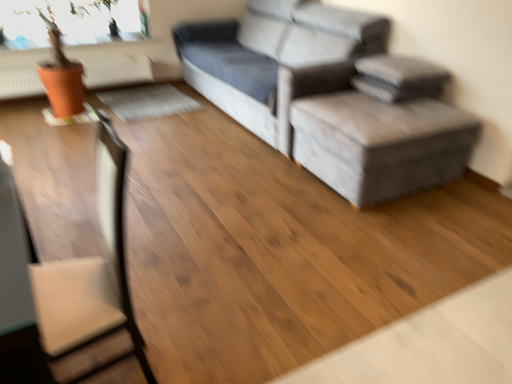
Measure the distance between gray fabric ottoman at center and camera.

gray fabric ottoman at center and camera are 7.65 feet apart.

This screenshot has height=384, width=512. What do you see at coordinates (380, 143) in the screenshot?
I see `gray fabric ottoman at center` at bounding box center [380, 143].

Identify the location of orange matte radiator at upper left. Image resolution: width=512 pixels, height=384 pixels. (117, 71).

Which of these two, brown leather swivel chair at left or gray fabric ottoman at center, is wider?

With larger width is gray fabric ottoman at center.

Considering the relative positions of brown leather swivel chair at left and gray fabric ottoman at center in the image provided, is brown leather swivel chair at left to the right of gray fabric ottoman at center from the viewer's perspective?

Incorrect, brown leather swivel chair at left is not on the right side of gray fabric ottoman at center.

Could you tell me if brown leather swivel chair at left is facing gray fabric ottoman at center?

No.

From a real-world perspective, is brown leather swivel chair at left physically located above or below gray fabric ottoman at center?

In terms of real-world spatial position, brown leather swivel chair at left is above gray fabric ottoman at center.

From a real-world perspective, is orange matte radiator at upper left on top of gray fabric couch at upper right?

Incorrect, from a real-world perspective, orange matte radiator at upper left is lower than gray fabric couch at upper right.

Is orange matte radiator at upper left facing away from gray fabric couch at upper right?

That's not correct — orange matte radiator at upper left is not looking away from gray fabric couch at upper right.

How much distance is there between orange matte radiator at upper left and gray fabric couch at upper right?

6.26 feet.

Which of these two, orange matte radiator at upper left or gray fabric couch at upper right, is thinner?

orange matte radiator at upper left is thinner.

Does gray fabric ottoman at center have a larger size compared to brown leather swivel chair at left?

Indeed, gray fabric ottoman at center has a larger size compared to brown leather swivel chair at left.

Is gray fabric ottoman at center in contact with brown leather swivel chair at left?

No, gray fabric ottoman at center is not making contact with brown leather swivel chair at left.

Is gray fabric ottoman at center at the left side of brown leather swivel chair at left?

In fact, gray fabric ottoman at center is to the right of brown leather swivel chair at left.

Between point (124, 84) and point (124, 172), which one is positioned in front?

The point (124, 172) is closer to the camera.

Relative to brown leather swivel chair at left, is orange matte radiator at upper left in front or behind?

orange matte radiator at upper left is positioned farther from the viewer than brown leather swivel chair at left.

Can you see orange matte radiator at upper left touching brown leather swivel chair at left?

No, orange matte radiator at upper left is not with brown leather swivel chair at left.

From the picture: How much distance is there between orange matte radiator at upper left and brown leather swivel chair at left?

The distance of orange matte radiator at upper left from brown leather swivel chair at left is 3.52 meters.

Is point (69, 350) positioned in front of point (7, 96)?

Yes.

From the image's perspective, is brown leather swivel chair at left above or below orange matte radiator at upper left?

Based on their image positions, brown leather swivel chair at left is located beneath orange matte radiator at upper left.

Is brown leather swivel chair at left touching orange matte radiator at upper left?

No, brown leather swivel chair at left is not touching orange matte radiator at upper left.

Locate an element on the screen. The image size is (512, 384). radiator behind the brown leather swivel chair at left is located at coordinates (117, 71).

Considering the points (53, 280) and (269, 33), which point is behind, point (53, 280) or point (269, 33)?

Positioned behind is point (269, 33).

From a real-world perspective, is brown leather swivel chair at left below gray fabric couch at upper right?

Indeed, from a real-world perspective, brown leather swivel chair at left is positioned beneath gray fabric couch at upper right.

Considering the sizes of brown leather swivel chair at left and gray fabric couch at upper right in the image, is brown leather swivel chair at left bigger or smaller than gray fabric couch at upper right?

In the image, brown leather swivel chair at left appears to be smaller than gray fabric couch at upper right.

At what (x,y) coordinates should I click in order to perform the action: click on studio couch on the right of brown leather swivel chair at left. Please return your answer as a coordinate pair (x, y). Looking at the image, I should click on (329, 100).

Which point is more distant from viewer, (263, 14) or (325, 118)?

The point (263, 14) is more distant.

Does gray fabric couch at upper right lie behind gray fabric ottoman at center?

Yes.

Considering the sizes of gray fabric couch at upper right and gray fabric ottoman at center in the image, is gray fabric couch at upper right bigger or smaller than gray fabric ottoman at center?

gray fabric couch at upper right is bigger than gray fabric ottoman at center.

From the image's perspective, between gray fabric couch at upper right and gray fabric ottoman at center, who is located below?

From the image's view, gray fabric ottoman at center is below.

I want to click on stool that is behind the brown leather swivel chair at left, so click(x=380, y=143).

I want to click on radiator below the gray fabric couch at upper right (from the image's perspective), so click(x=117, y=71).

Estimate the real-world distances between objects in this image. Which object is closer to orange matte radiator at upper left, brown leather swivel chair at left or gray fabric ottoman at center?

gray fabric ottoman at center is closer to orange matte radiator at upper left.

Estimate the real-world distances between objects in this image. Which object is closer to brown leather swivel chair at left, orange matte radiator at upper left or gray fabric couch at upper right?

The object closer to brown leather swivel chair at left is gray fabric couch at upper right.

Considering their positions, is orange matte radiator at upper left positioned closer to brown leather swivel chair at left than gray fabric ottoman at center?

gray fabric ottoman at center lies closer to brown leather swivel chair at left than the other object.

Based on their spatial positions, is orange matte radiator at upper left or gray fabric ottoman at center closer to gray fabric couch at upper right?

Among the two, gray fabric ottoman at center is located nearer to gray fabric couch at upper right.

Which object lies nearer to the anchor point gray fabric ottoman at center, gray fabric couch at upper right or orange matte radiator at upper left?

Among the two, gray fabric couch at upper right is located nearer to gray fabric ottoman at center.

Estimate the real-world distances between objects in this image. Which object is further from gray fabric couch at upper right, gray fabric ottoman at center or brown leather swivel chair at left?

Among the two, brown leather swivel chair at left is located further to gray fabric couch at upper right.

From the picture: Based on their spatial positions, is gray fabric ottoman at center or orange matte radiator at upper left further from brown leather swivel chair at left?

orange matte radiator at upper left.

Based on their spatial positions, is orange matte radiator at upper left or brown leather swivel chair at left closer to gray fabric ottoman at center?

brown leather swivel chair at left is positioned closer to the anchor gray fabric ottoman at center.

Locate an element on the screen. Image resolution: width=512 pixels, height=384 pixels. stool between brown leather swivel chair at left and orange matte radiator at upper left along the z-axis is located at coordinates (380, 143).

The width and height of the screenshot is (512, 384). Identify the location of studio couch between orange matte radiator at upper left and gray fabric ottoman at center. (329, 100).

This screenshot has width=512, height=384. Find the location of `studio couch between brown leather swivel chair at left and orange matte radiator at upper left from front to back`. studio couch between brown leather swivel chair at left and orange matte radiator at upper left from front to back is located at coordinates (329, 100).

In order to click on stool located between brown leather swivel chair at left and gray fabric couch at upper right in the depth direction in this screenshot , I will do 380,143.